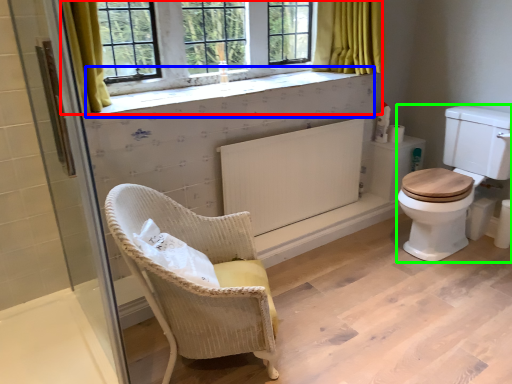
Question: Estimate the real-world distances between objects in this image. Which object is farther from window (highlighted by a red box), window sill (highlighted by a blue box) or rocking chair (highlighted by a green box)?

Choices:
 (A) window sill
 (B) rocking chair

Answer: (B)